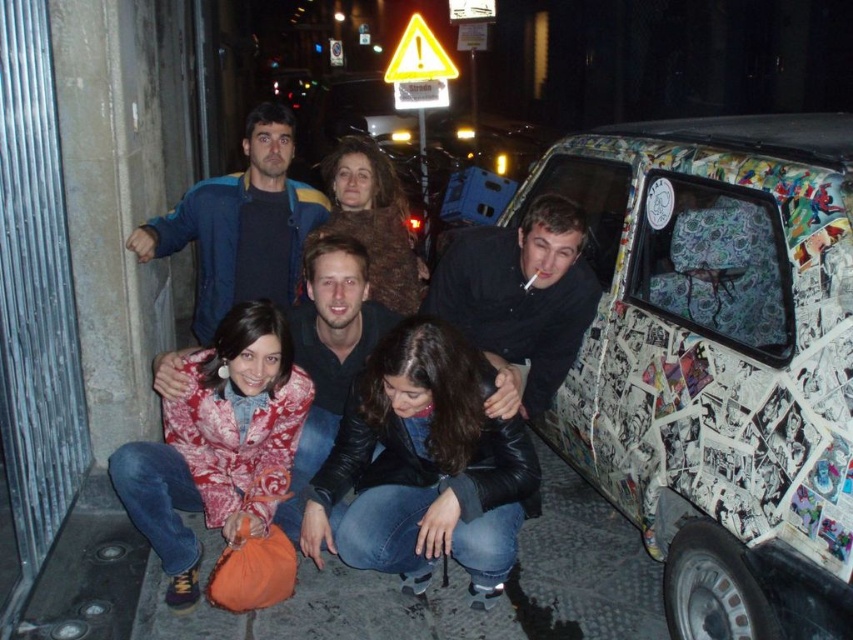
Based on the photo, you are a photographer trying to decide which jacket to focus on for a closeup shot. Given that the leather jacket at center and the printed fabric jacket at lower left are both in the frame, which one would you choose if you want to capture more details of the jacket in the photo?

The printed fabric jacket at lower left is smaller than the leather jacket at center, so focusing on the printed fabric jacket at lower left would allow you to capture more details in the closeup shot.